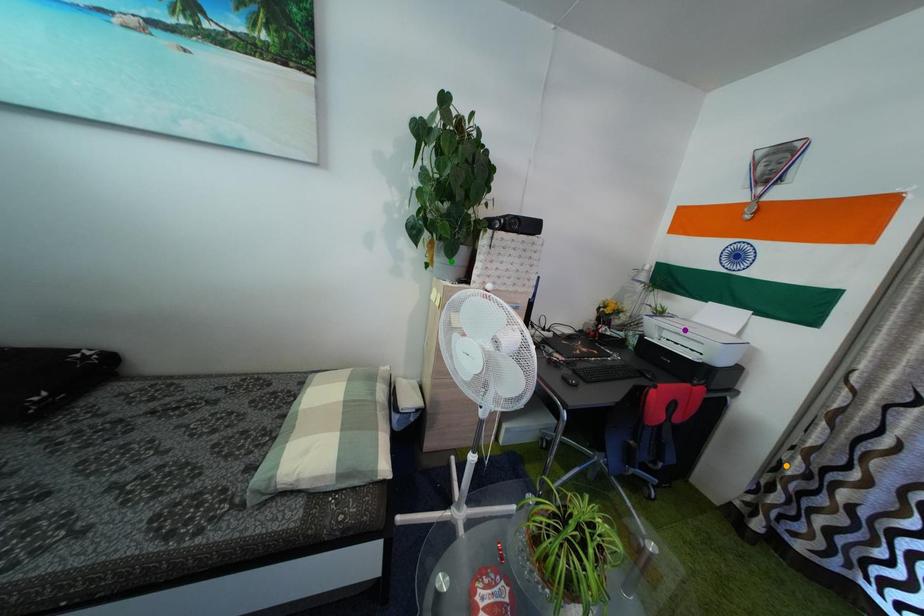
Order these from nearest to farthest:
orange point | green point | purple point

orange point < green point < purple point